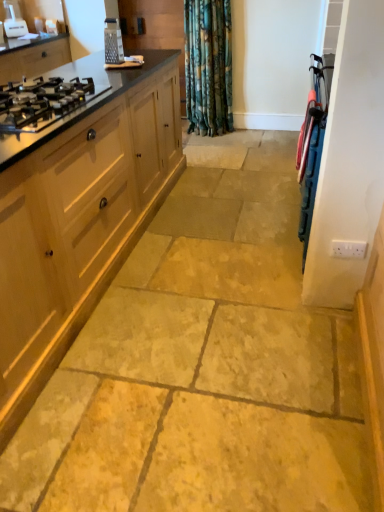
Question: In terms of height, does metallic grater at upper left, which ranks as the 1th appliance in front-to-back order, look taller or shorter compared to light wood cabinet at left, which is the first cabinetry from bottom to top?

Choices:
 (A) short
 (B) tall

Answer: (A)

Question: From a real-world perspective, is metallic grater at upper left, the first appliance from the bottom, positioned above or below light wood cabinet at left, placed as the first cabinetry when sorted from front to back?

Choices:
 (A) below
 (B) above

Answer: (B)

Question: Which object is positioned closest to the black glass gas stove at left?

Choices:
 (A) white plastic appliance at upper left, the second appliance from the right
 (B) light wood cabinet at left, positioned as the 2th cabinetry in back-to-front order
 (C) blue plastic screen door at right
 (D) matte wood stove at upper left, which appears as the first cabinetry when viewed from the back
 (E) metallic grater at upper left, the first appliance from the bottom

Answer: (B)

Question: Estimate the real-world distances between objects in this image. Which object is farther from the blue plastic screen door at right?

Choices:
 (A) matte wood stove at upper left, which appears as the first cabinetry when viewed from the back
 (B) white plastic appliance at upper left, the 1th appliance positioned from the left
 (C) metallic grater at upper left, acting as the first appliance starting from the right
 (D) black glass gas stove at left
 (E) light wood cabinet at left, which is counted as the 2th cabinetry, starting from the top

Answer: (C)